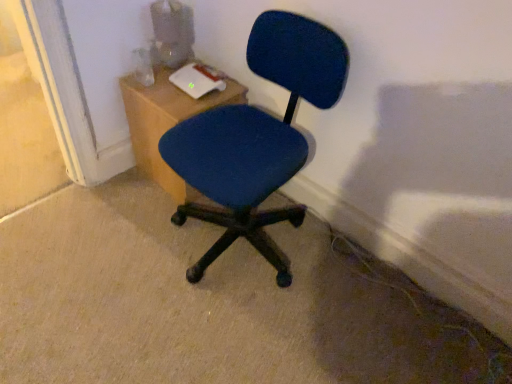
Find the location of a particular element. vacant space that is to the left of blue fabric chair at center is located at coordinates (100, 244).